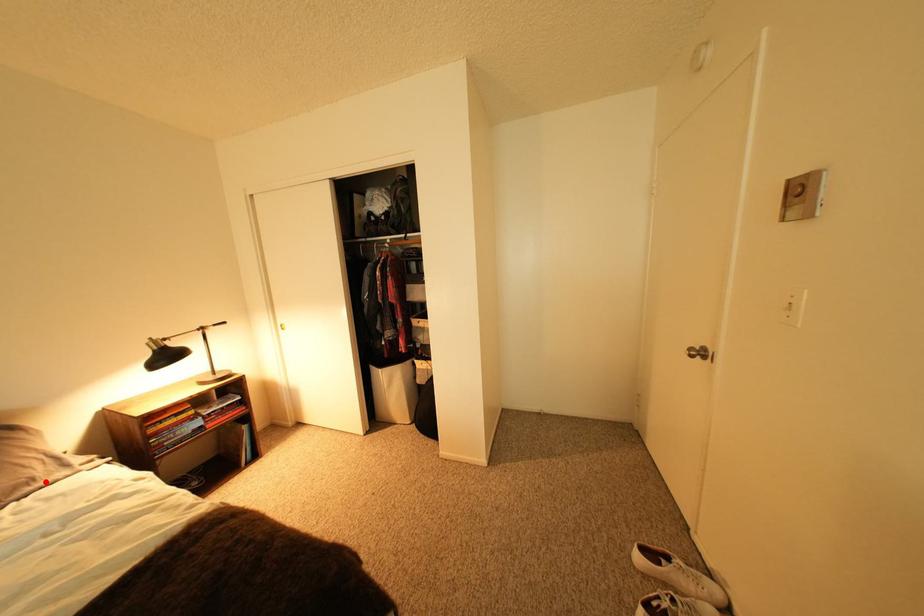
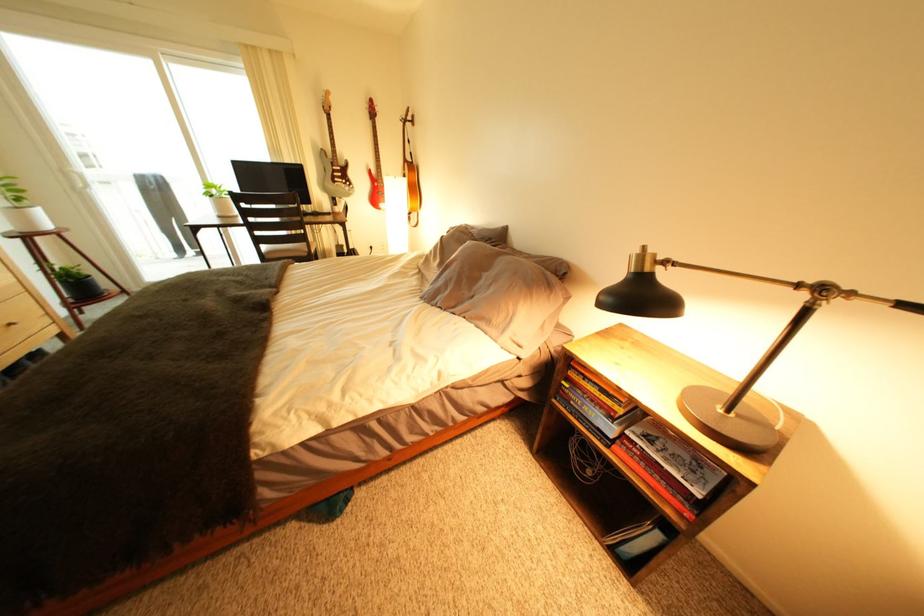
Find the pixel in the second image that matches the highlighted location in the first image.

(503, 323)